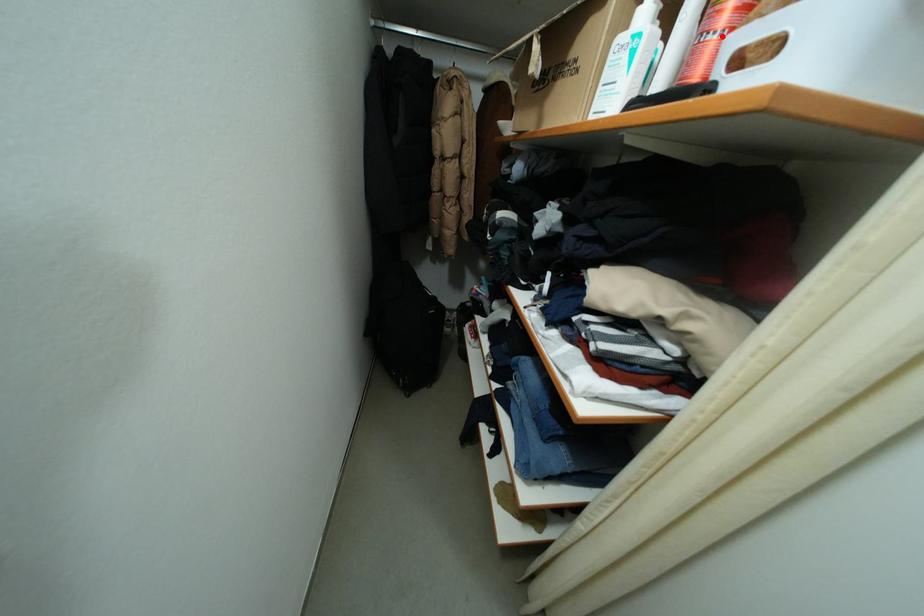
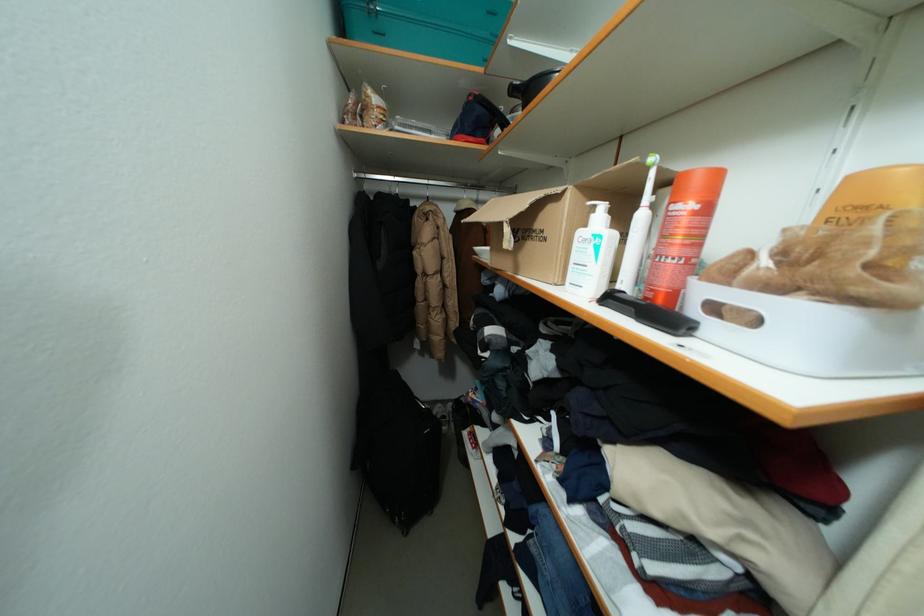
The point at the highlighted location is marked in the first image. Where is the corresponding point in the second image?

(681, 262)